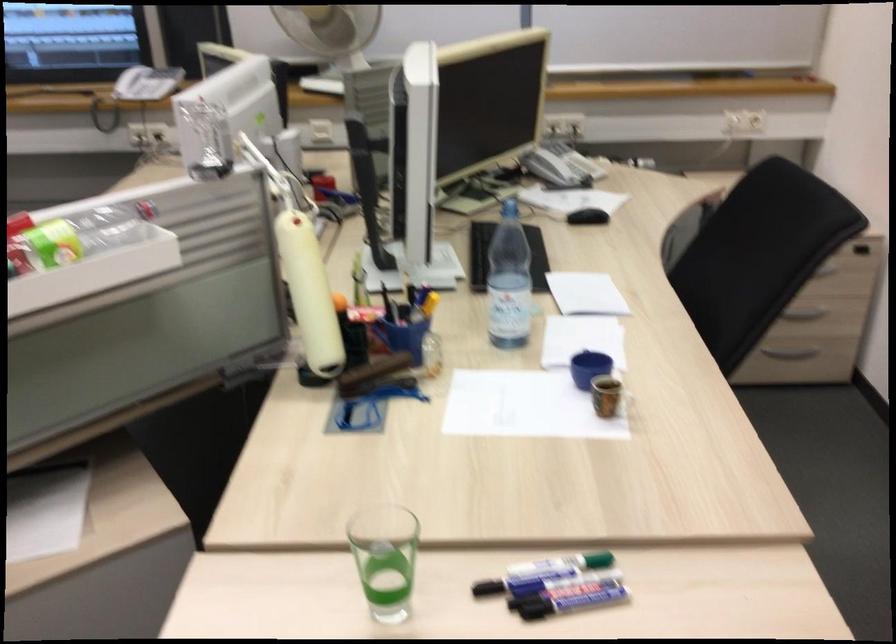
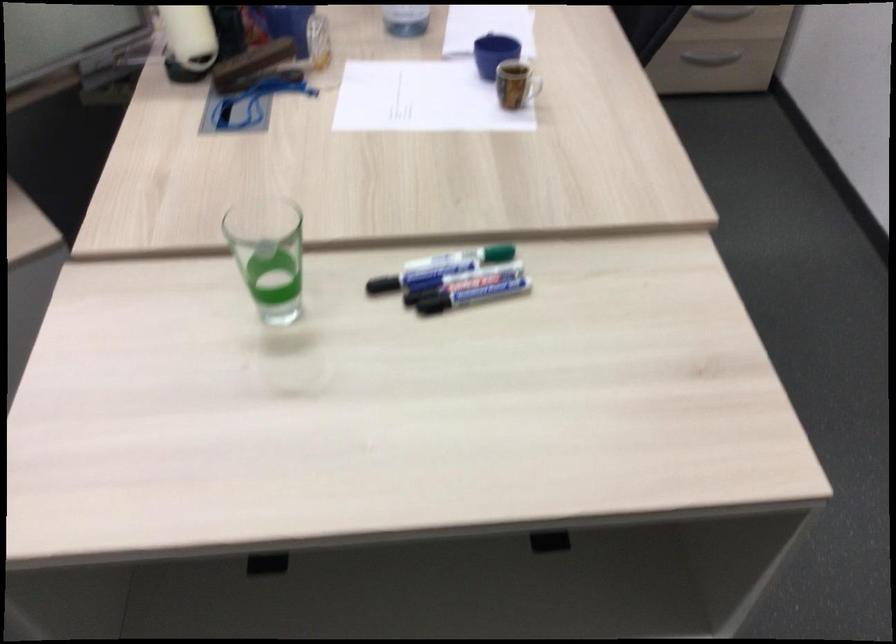
Question: How did the camera likely rotate?

Choices:
 (A) Left
 (B) Right
 (C) Up
 (D) Down

Answer: (D)